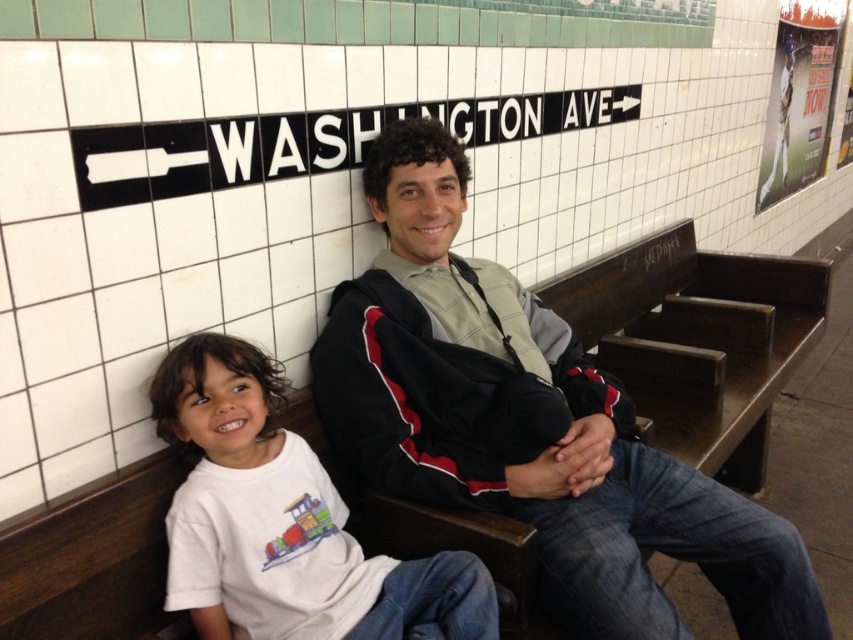
Question: Can you confirm if dark gray jacket at center is bigger than white cotton shirt at lower left?

Choices:
 (A) yes
 (B) no

Answer: (A)

Question: Can you confirm if dark gray jacket at center is positioned to the left of white cotton shirt at lower left?

Choices:
 (A) no
 (B) yes

Answer: (A)

Question: Does dark gray jacket at center appear over white cotton shirt at lower left?

Choices:
 (A) no
 (B) yes

Answer: (B)